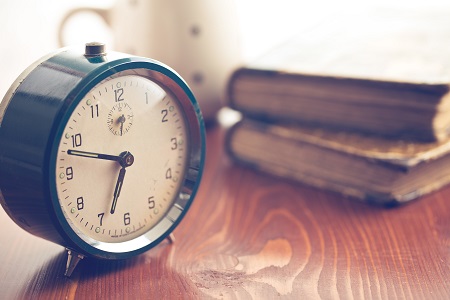
The width and height of the screenshot is (450, 300). I want to click on clock stand, so click(x=70, y=263), click(x=174, y=238).